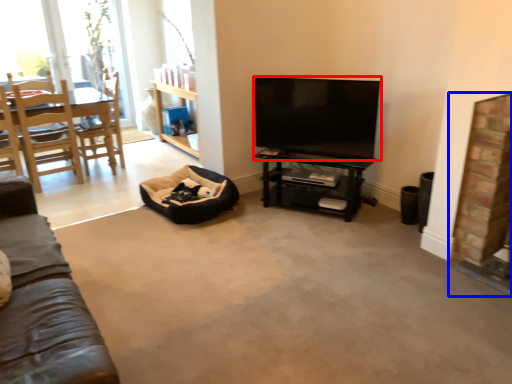
Question: Among these objects, which one is nearest to the camera, television (highlighted by a red box) or fireplace (highlighted by a blue box)?

Choices:
 (A) television
 (B) fireplace

Answer: (B)